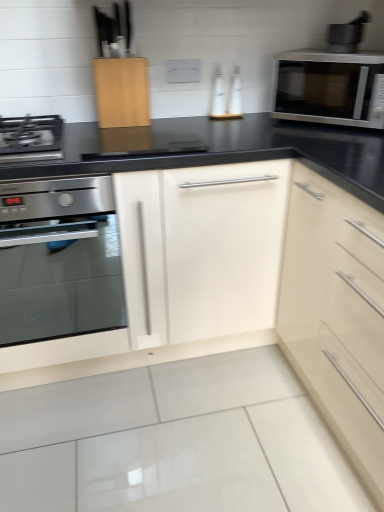
Question: Can you confirm if metallic gray mortar and pestle at upper right is bigger than satin stainless steel oven at left?

Choices:
 (A) no
 (B) yes

Answer: (A)

Question: Is metallic gray mortar and pestle at upper right positioned beyond the bounds of satin stainless steel oven at left?

Choices:
 (A) no
 (B) yes

Answer: (B)

Question: Is metallic gray mortar and pestle at upper right shorter than satin stainless steel oven at left?

Choices:
 (A) no
 (B) yes

Answer: (B)

Question: From the image's perspective, is metallic gray mortar and pestle at upper right located beneath satin stainless steel oven at left?

Choices:
 (A) yes
 (B) no

Answer: (B)

Question: From a real-world perspective, is metallic gray mortar and pestle at upper right located higher than satin stainless steel oven at left?

Choices:
 (A) yes
 (B) no

Answer: (A)

Question: Does metallic gray mortar and pestle at upper right have a greater width compared to satin stainless steel oven at left?

Choices:
 (A) no
 (B) yes

Answer: (A)

Question: Does satin silver microwave at upper right lie behind metallic gray mortar and pestle at upper right?

Choices:
 (A) no
 (B) yes

Answer: (A)

Question: Can you confirm if satin silver microwave at upper right is bigger than metallic gray mortar and pestle at upper right?

Choices:
 (A) yes
 (B) no

Answer: (A)

Question: Is satin silver microwave at upper right to the right of metallic gray mortar and pestle at upper right from the viewer's perspective?

Choices:
 (A) no
 (B) yes

Answer: (A)

Question: Is metallic gray mortar and pestle at upper right inside satin silver microwave at upper right?

Choices:
 (A) yes
 (B) no

Answer: (B)

Question: From the image's perspective, is satin silver microwave at upper right under metallic gray mortar and pestle at upper right?

Choices:
 (A) yes
 (B) no

Answer: (A)

Question: Is satin silver microwave at upper right outside of metallic gray mortar and pestle at upper right?

Choices:
 (A) yes
 (B) no

Answer: (A)

Question: Can you confirm if satin stainless steel oven at left is bigger than satin silver microwave at upper right?

Choices:
 (A) no
 (B) yes

Answer: (B)